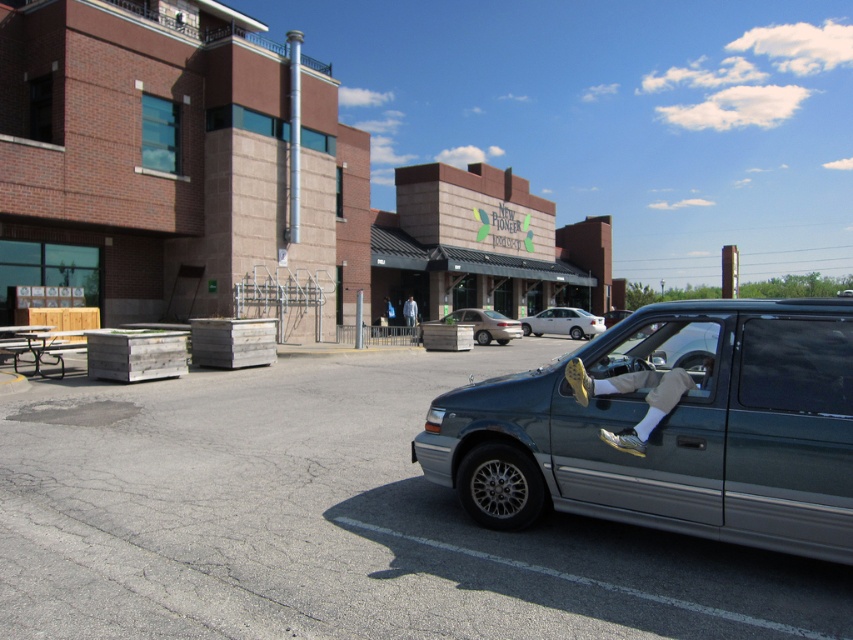
Question: Is metallic green minivan at right positioned in front of green painted metal picnic table at left?

Choices:
 (A) no
 (B) yes

Answer: (B)

Question: Which object is the farthest from the metallic green minivan at right?

Choices:
 (A) green painted metal picnic table at left
 (B) white glossy sedan at center
 (C) silver metallic sedan at center
 (D) asphalt at center

Answer: (B)

Question: Is white glossy sedan at center smaller than silver metallic sedan at center?

Choices:
 (A) yes
 (B) no

Answer: (A)

Question: Considering the real-world distances, which object is closest to the white glossy sedan at center?

Choices:
 (A) silver metallic sedan at center
 (B) asphalt at center

Answer: (A)

Question: Can you confirm if asphalt at center is positioned below white glossy sedan at center?

Choices:
 (A) yes
 (B) no

Answer: (A)

Question: Which point appears farthest from the camera in this image?

Choices:
 (A) (508, 323)
 (B) (553, 320)
 (C) (13, 330)
 (D) (769, 470)

Answer: (B)